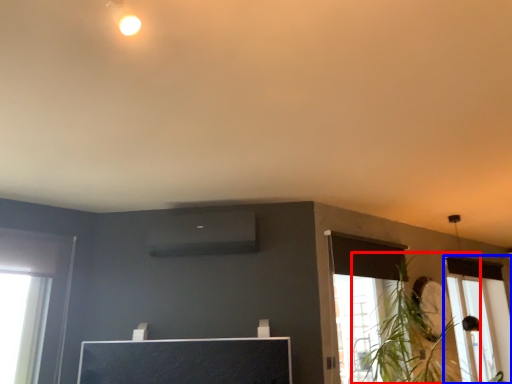
Question: Which object is closer to the camera taking this photo, plant (highlighted by a red box) or window (highlighted by a blue box)?

Choices:
 (A) plant
 (B) window

Answer: (A)